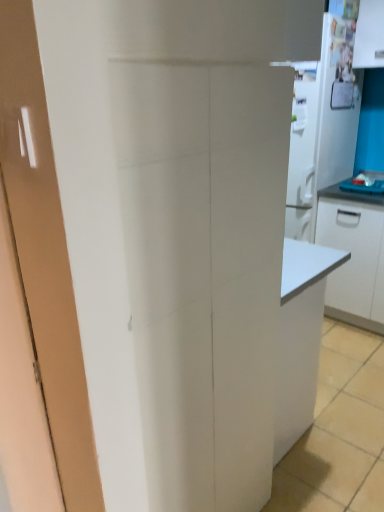
Question: In the image, is white glossy cabinet at right on the left side or the right side of white glossy refrigerator at upper right?

Choices:
 (A) left
 (B) right

Answer: (B)

Question: From the image's perspective, relative to white glossy refrigerator at upper right, is white glossy cabinet at right above or below?

Choices:
 (A) below
 (B) above

Answer: (A)

Question: Estimate the real-world distances between objects in this image. Which object is closer to the blue laminate countertop at right?

Choices:
 (A) white glossy refrigerator at upper right
 (B) white glossy cabinet at right

Answer: (B)

Question: Which object is the farthest from the white glossy cabinet at right?

Choices:
 (A) blue laminate countertop at right
 (B) white glossy refrigerator at upper right

Answer: (B)